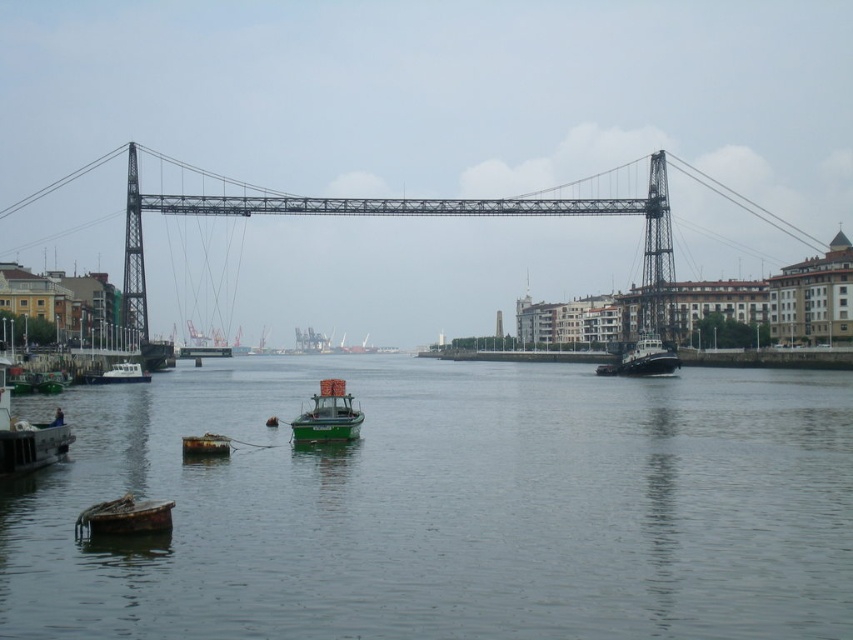
You are a photographer planning to capture a wide shot of the waterfront scene. You want to ensure both the rusty wooden boat at lower left and the green matte tugboat at right are in the frame. Based on their positions, which boat should you position closer to the left side of your camera frame?

The rusty wooden boat at lower left should be positioned closer to the left side of your camera frame since it is located to the left of the green matte tugboat at right in the scene.